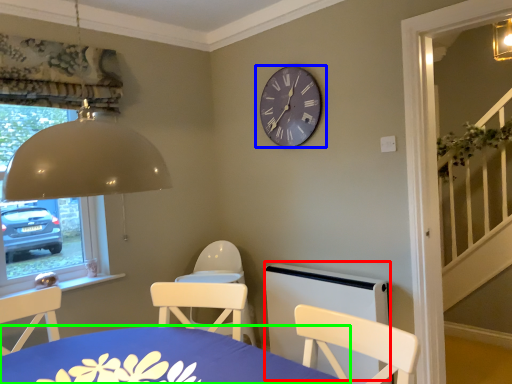
Question: Based on their relative distances, which object is nearer to bed frame (highlighted by a red box)? Choose from wall clock (highlighted by a blue box) and table (highlighted by a green box).

Choices:
 (A) wall clock
 (B) table

Answer: (A)